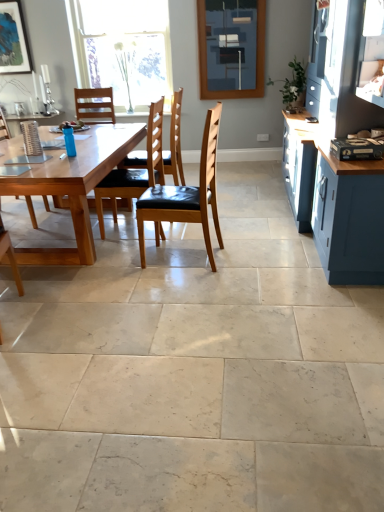
Image resolution: width=384 pixels, height=512 pixels. I want to click on free location in front of matte blue cabinet at right, so click(x=230, y=334).